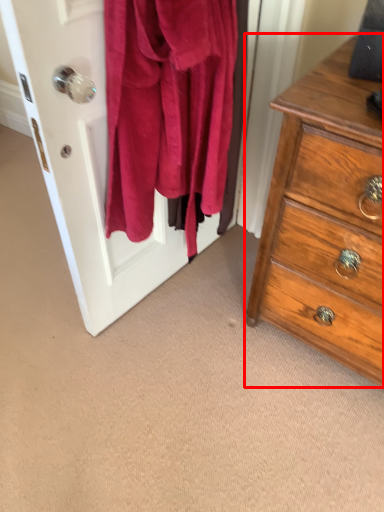
Question: From the image's perspective, where is chest of drawers (annotated by the red box) located relative to screen door?

Choices:
 (A) below
 (B) above

Answer: (A)